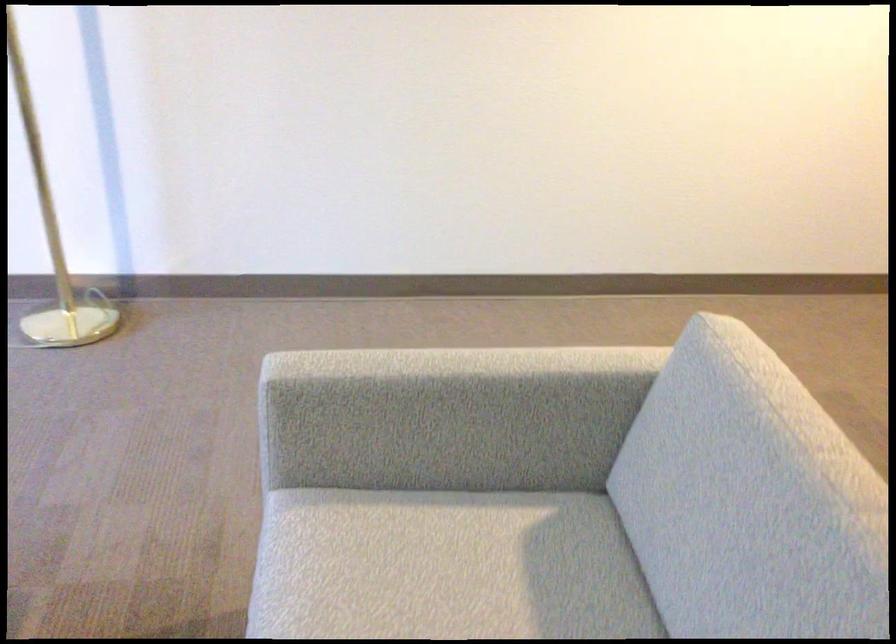
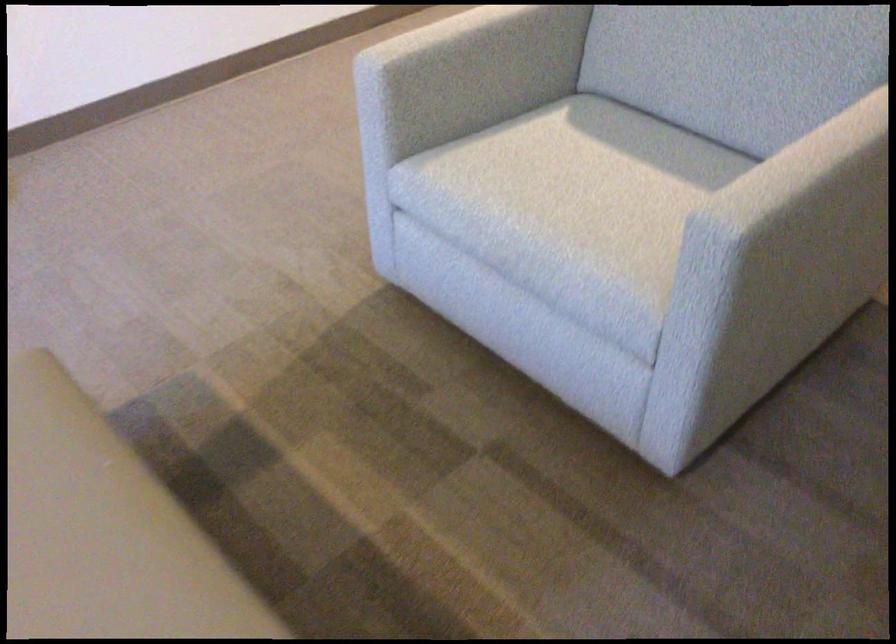
Locate, in the second image, the point that corresponds to point 271,449 in the first image.

(385, 120)